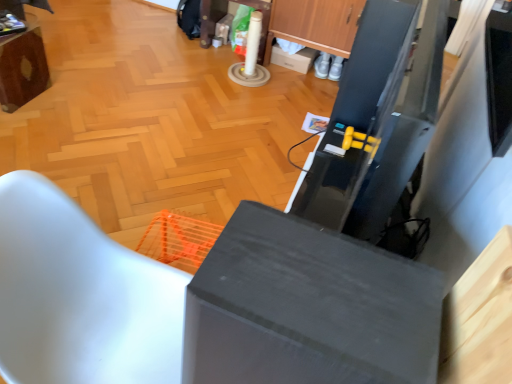
Question: Is white matte chair at lower left, arranged as the first furniture when viewed from the front, oriented towards white cardboard box at center?

Choices:
 (A) no
 (B) yes

Answer: (A)

Question: From a real-world perspective, is white matte chair at lower left, positioned as the 1th furniture in right-to-left order, on white cardboard box at center?

Choices:
 (A) no
 (B) yes

Answer: (B)

Question: Is white matte chair at lower left, arranged as the first furniture when viewed from the front, looking in the opposite direction of white cardboard box at center?

Choices:
 (A) no
 (B) yes

Answer: (A)

Question: Are white matte chair at lower left, the 2th furniture in the back-to-front sequence, and white cardboard box at center located far from each other?

Choices:
 (A) no
 (B) yes

Answer: (B)

Question: Does white matte chair at lower left, positioned as the 1th furniture in right-to-left order, lie in front of white cardboard box at center?

Choices:
 (A) no
 (B) yes

Answer: (B)

Question: Is white matte chair at lower left, the 2th furniture in the back-to-front sequence, beside white cardboard box at center?

Choices:
 (A) no
 (B) yes

Answer: (A)

Question: Considering the relative sizes of matte gray cabinet at center and wooden table at upper left, which is the 2th furniture from bottom to top, in the image provided, is matte gray cabinet at center bigger than wooden table at upper left, which is the 2th furniture from bottom to top,?

Choices:
 (A) no
 (B) yes

Answer: (B)

Question: Considering the relative sizes of matte gray cabinet at center and wooden table at upper left, the 1th furniture viewed from the left, in the image provided, is matte gray cabinet at center shorter than wooden table at upper left, the 1th furniture viewed from the left,?

Choices:
 (A) yes
 (B) no

Answer: (B)

Question: Does matte gray cabinet at center have a smaller size compared to wooden table at upper left, placed as the first furniture when sorted from top to bottom?

Choices:
 (A) yes
 (B) no

Answer: (B)

Question: Is matte gray cabinet at center facing towards wooden table at upper left, arranged as the 2th furniture when viewed from the front?

Choices:
 (A) no
 (B) yes

Answer: (A)

Question: From the image's perspective, would you say matte gray cabinet at center is positioned over wooden table at upper left, arranged as the 2th furniture when viewed from the front?

Choices:
 (A) no
 (B) yes

Answer: (A)

Question: Is matte gray cabinet at center further to the viewer compared to wooden table at upper left, placed as the first furniture when sorted from top to bottom?

Choices:
 (A) yes
 (B) no

Answer: (B)

Question: Is white matte chair at lower left, positioned as the 1th furniture in right-to-left order, oriented away from wooden cabinet at upper center?

Choices:
 (A) yes
 (B) no

Answer: (B)